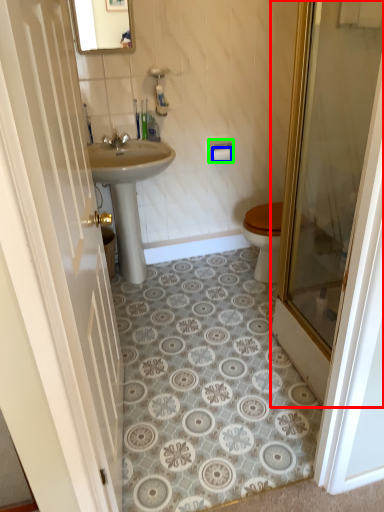
Question: Considering the real-world distances, which object is closest to door (highlighted by a red box)? toilet paper (highlighted by a blue box) or towel bar (highlighted by a green box).

Choices:
 (A) toilet paper
 (B) towel bar

Answer: (B)